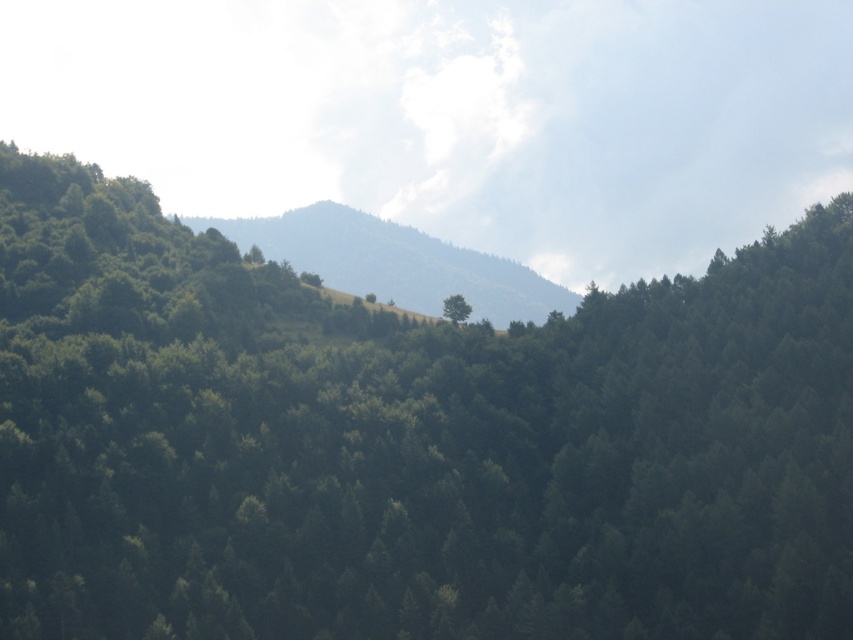
Is point (370, 282) more distant than point (453, 312)?

Yes, it is behind point (453, 312).

Between point (541, 298) and point (445, 307), which one is positioned in front?

Positioned in front is point (445, 307).

Between point (527, 278) and point (450, 310), which one is positioned in front?

Point (450, 310)

Identify the location of green grassy hillside at center. (393, 262).